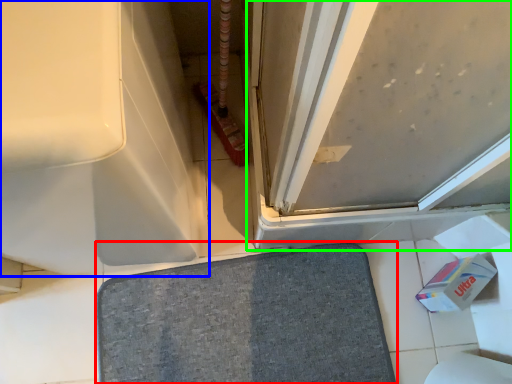
Question: Which object is the closest to the bath mat (highlighted by a red box)? Choose among these: bath (highlighted by a blue box) or screen door (highlighted by a green box).

Choices:
 (A) bath
 (B) screen door

Answer: (A)